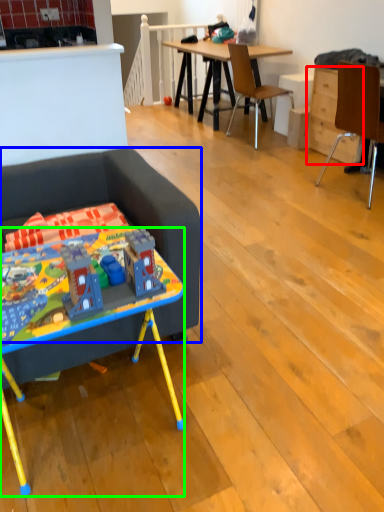
Question: Which object is the closest to the drawer (highlighted by a red box)? Choose among these: studio couch (highlighted by a blue box) or desk (highlighted by a green box).

Choices:
 (A) studio couch
 (B) desk

Answer: (A)